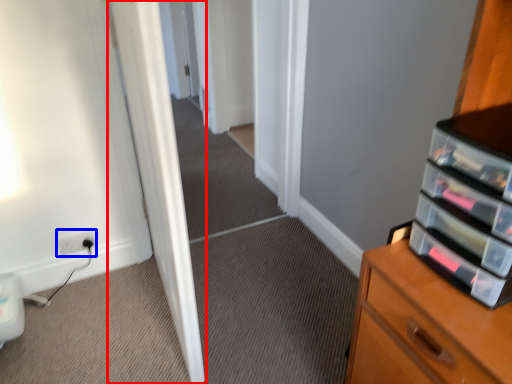
Question: Which point is closer to the camera, door (highlighted by a red box) or electric outlet (highlighted by a blue box)?

Choices:
 (A) door
 (B) electric outlet

Answer: (A)